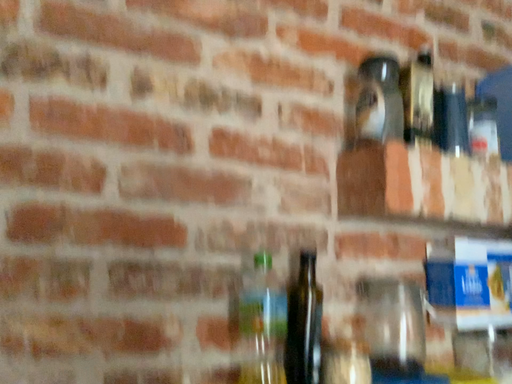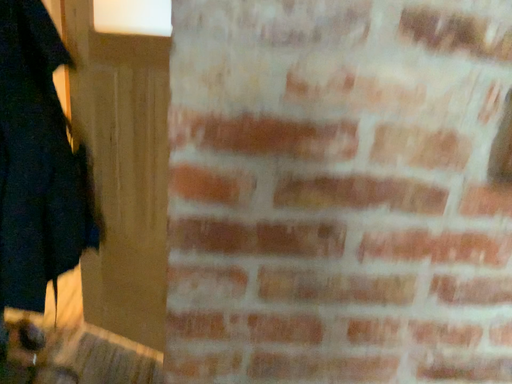
Question: How did the camera likely rotate when shooting the video?

Choices:
 (A) rotated upward
 (B) rotated downward

Answer: (B)